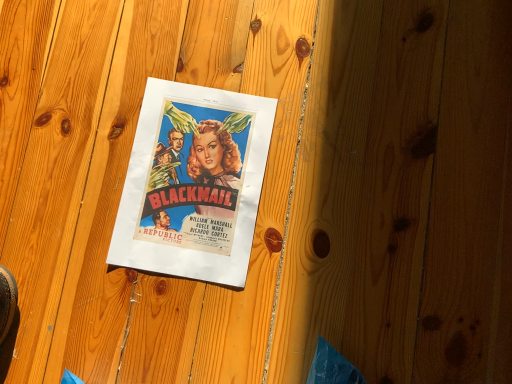
Measure the distance between point (207, 92) and camera.

26.81 inches.

Image resolution: width=512 pixels, height=384 pixels. What do you see at coordinates (193, 183) in the screenshot?
I see `matte paper poster at center` at bounding box center [193, 183].

In order to click on matte paper poster at center in this screenshot , I will do `click(193, 183)`.

Where is `matte paper poster at center`? matte paper poster at center is located at coordinates (193, 183).